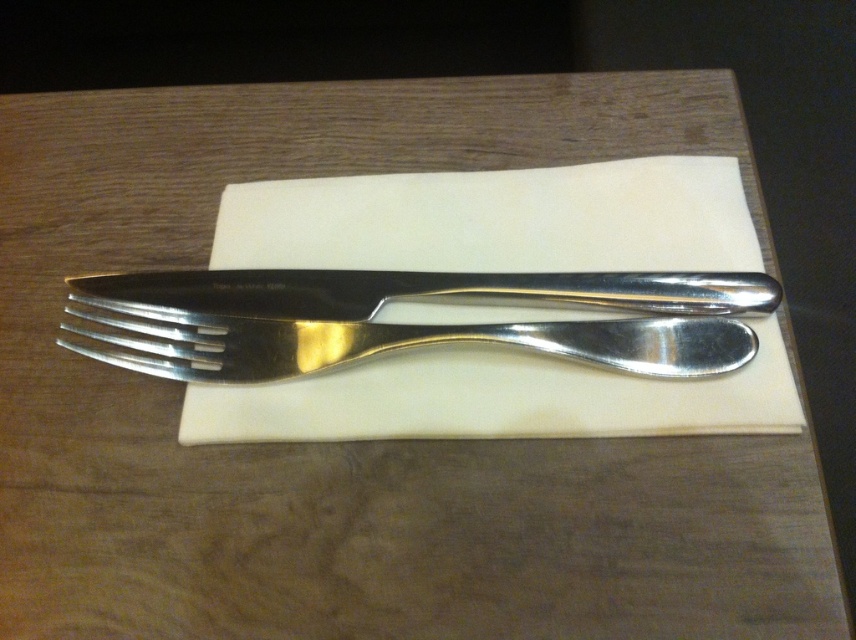
Question: Is the position of white paper napkin at center less distant than that of polished silver knife at center?

Choices:
 (A) no
 (B) yes

Answer: (B)

Question: Does polished silver fork at center appear on the left side of polished silver knife at center?

Choices:
 (A) no
 (B) yes

Answer: (B)

Question: Considering the relative positions of polished silver fork at center and polished silver knife at center in the image provided, where is polished silver fork at center located with respect to polished silver knife at center?

Choices:
 (A) below
 (B) above

Answer: (A)

Question: Among these objects, which one is farthest from the camera?

Choices:
 (A) white paper napkin at center
 (B) polished silver fork at center
 (C) polished silver knife at center

Answer: (C)

Question: Among these points, which one is nearest to the camera?

Choices:
 (A) (586, 356)
 (B) (223, 250)
 (C) (319, 301)

Answer: (A)

Question: Which of these objects is positioned farthest from the white paper napkin at center?

Choices:
 (A) polished silver fork at center
 (B) polished silver knife at center

Answer: (A)